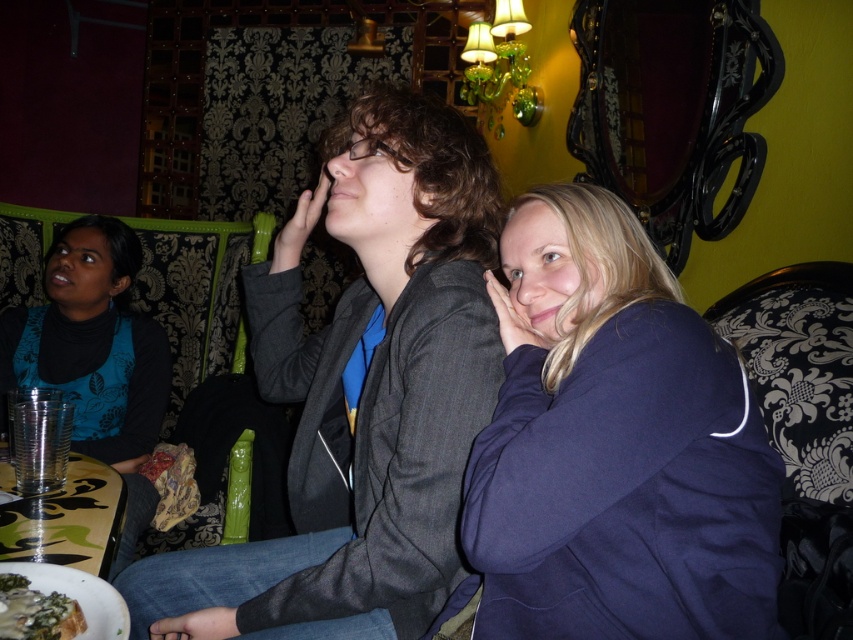
Which is more to the right, matte gray blazer at center or savory green pesto sauce at lower left?

matte gray blazer at center

Does matte gray blazer at center appear on the left side of savory green pesto sauce at lower left?

In fact, matte gray blazer at center is to the right of savory green pesto sauce at lower left.

This screenshot has height=640, width=853. What do you see at coordinates (361, 392) in the screenshot?
I see `matte gray blazer at center` at bounding box center [361, 392].

At what (x,y) coordinates should I click in order to perform the action: click on matte gray blazer at center. Please return your answer as a coordinate pair (x, y). The height and width of the screenshot is (640, 853). Looking at the image, I should click on (361, 392).

Between camouflage-patterned table at lower left and savory green pesto sauce at lower left, which one is positioned higher?

Positioned higher is savory green pesto sauce at lower left.

Is camouflage-patterned table at lower left positioned before savory green pesto sauce at lower left?

No.

Is point (45, 502) more distant than point (33, 636)?

Yes, it is behind point (33, 636).

What are the coordinates of `camouflage-patterned table at lower left` in the screenshot? It's located at (68, 518).

Can you confirm if blue patterned top at left is taller than camouflage-patterned table at lower left?

Yes.

Can you confirm if blue patterned top at left is positioned below camouflage-patterned table at lower left?

No, blue patterned top at left is not below camouflage-patterned table at lower left.

Does point (0, 321) lie in front of point (38, 509)?

That is False.

Where is `blue patterned top at left`? blue patterned top at left is located at coordinates (93, 342).